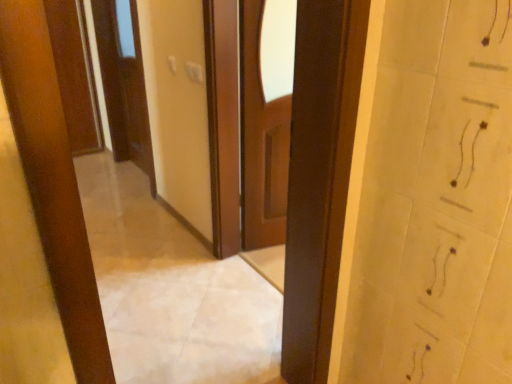
The image size is (512, 384). What do you see at coordinates (124, 85) in the screenshot?
I see `matte brown door at upper left, which ranks as the second door in left-to-right order` at bounding box center [124, 85].

I want to click on matte brown door at upper left, which ranks as the second door in left-to-right order, so click(124, 85).

What is the approximate width of matte brown door at upper left, the 1th door from the right?

6.95 inches.

Measure the distance between point (x=116, y=79) and camera.

The depth of point (x=116, y=79) is 3.57 meters.

What do you see at coordinates (75, 74) in the screenshot?
I see `wooden door at upper left, which ranks as the 1th door in left-to-right order` at bounding box center [75, 74].

The height and width of the screenshot is (384, 512). I want to click on wooden door at upper left, the 2th door positioned from the right, so click(x=75, y=74).

Identify the location of matte brown door at upper left, which ranks as the second door in left-to-right order. The image size is (512, 384). (124, 85).

Is matte brown door at upper left, the 1th door from the right, at the left side of wooden door at upper left, which ranks as the 1th door in left-to-right order?

Incorrect, matte brown door at upper left, the 1th door from the right, is not on the left side of wooden door at upper left, which ranks as the 1th door in left-to-right order.

Which is behind, matte brown door at upper left, the 1th door from the right, or wooden door at upper left, which ranks as the 1th door in left-to-right order?

wooden door at upper left, which ranks as the 1th door in left-to-right order, is behind.

Considering the points (142, 98) and (85, 47), which point is behind, point (142, 98) or point (85, 47)?

The point (85, 47) is more distant.

From the image's perspective, which one is positioned lower, matte brown door at upper left, which ranks as the second door in left-to-right order, or wooden door at upper left, which ranks as the 1th door in left-to-right order?

matte brown door at upper left, which ranks as the second door in left-to-right order.

From a real-world perspective, is matte brown door at upper left, the 1th door from the right, on wooden door at upper left, the 2th door positioned from the right?

Indeed, from a real-world perspective, matte brown door at upper left, the 1th door from the right, stands above wooden door at upper left, the 2th door positioned from the right.

In terms of width, does matte brown door at upper left, the 1th door from the right, look wider or thinner when compared to wooden door at upper left, which ranks as the 1th door in left-to-right order?

In the image, matte brown door at upper left, the 1th door from the right, appears to be wider than wooden door at upper left, which ranks as the 1th door in left-to-right order.

Considering the relative sizes of matte brown door at upper left, which ranks as the second door in left-to-right order, and wooden door at upper left, which ranks as the 1th door in left-to-right order, in the image provided, is matte brown door at upper left, which ranks as the second door in left-to-right order, shorter than wooden door at upper left, which ranks as the 1th door in left-to-right order,?

In fact, matte brown door at upper left, which ranks as the second door in left-to-right order, may be taller than wooden door at upper left, which ranks as the 1th door in left-to-right order.

Based on their sizes in the image, would you say matte brown door at upper left, the 1th door from the right, is bigger or smaller than wooden door at upper left, which ranks as the 1th door in left-to-right order?

matte brown door at upper left, the 1th door from the right, is bigger than wooden door at upper left, which ranks as the 1th door in left-to-right order.

Is wooden door at upper left, the 2th door positioned from the right, located within matte brown door at upper left, the 1th door from the right?

No, wooden door at upper left, the 2th door positioned from the right, is not inside matte brown door at upper left, the 1th door from the right.

Is matte brown door at upper left, the 1th door from the right, far from wooden door at upper left, the 2th door positioned from the right?

matte brown door at upper left, the 1th door from the right, is near wooden door at upper left, the 2th door positioned from the right, not far away.

Is wooden door at upper left, the 2th door positioned from the right, at the back of matte brown door at upper left, which ranks as the second door in left-to-right order?

matte brown door at upper left, which ranks as the second door in left-to-right order, is not turned away from wooden door at upper left, the 2th door positioned from the right.

How far apart are matte brown door at upper left, the 1th door from the right, and wooden door at upper left, the 2th door positioned from the right?

matte brown door at upper left, the 1th door from the right, and wooden door at upper left, the 2th door positioned from the right, are 46.56 centimeters apart from each other.

At what (x,y) coordinates should I click in order to perform the action: click on door that is on the right side of wooden door at upper left, which ranks as the 1th door in left-to-right order. Please return your answer as a coordinate pair (x, y). Looking at the image, I should click on (124, 85).

Does wooden door at upper left, which ranks as the 1th door in left-to-right order, appear on the left side of matte brown door at upper left, the 1th door from the right?

Yes, wooden door at upper left, which ranks as the 1th door in left-to-right order, is to the left of matte brown door at upper left, the 1th door from the right.

Which is in front, wooden door at upper left, which ranks as the 1th door in left-to-right order, or matte brown door at upper left, which ranks as the second door in left-to-right order?

matte brown door at upper left, which ranks as the second door in left-to-right order.

Does point (73, 52) lie in front of point (117, 95)?

No.

From the image's perspective, between wooden door at upper left, the 2th door positioned from the right, and matte brown door at upper left, the 1th door from the right, who is located below?

From the image's view, matte brown door at upper left, the 1th door from the right, is below.

From a real-world perspective, between wooden door at upper left, the 2th door positioned from the right, and matte brown door at upper left, the 1th door from the right, who is vertically lower?

wooden door at upper left, the 2th door positioned from the right, from a real-world perspective.

Can you confirm if wooden door at upper left, the 2th door positioned from the right, is wider than matte brown door at upper left, the 1th door from the right?

Incorrect, the width of wooden door at upper left, the 2th door positioned from the right, does not surpass that of matte brown door at upper left, the 1th door from the right.

Can you confirm if wooden door at upper left, which ranks as the 1th door in left-to-right order, is taller than matte brown door at upper left, which ranks as the second door in left-to-right order?

No.

Between wooden door at upper left, which ranks as the 1th door in left-to-right order, and matte brown door at upper left, which ranks as the second door in left-to-right order, which one has larger size?

matte brown door at upper left, which ranks as the second door in left-to-right order.

Choose the correct answer: Is wooden door at upper left, the 2th door positioned from the right, inside matte brown door at upper left, which ranks as the second door in left-to-right order, or outside it?

wooden door at upper left, the 2th door positioned from the right, exists outside the volume of matte brown door at upper left, which ranks as the second door in left-to-right order.

Based on the photo, is wooden door at upper left, which ranks as the 1th door in left-to-right order, next to matte brown door at upper left, the 1th door from the right, and touching it?

wooden door at upper left, which ranks as the 1th door in left-to-right order, is not next to matte brown door at upper left, the 1th door from the right, and they're not touching.

In the scene shown: Is wooden door at upper left, the 2th door positioned from the right, aimed at matte brown door at upper left, the 1th door from the right?

Yes, wooden door at upper left, the 2th door positioned from the right, faces towards matte brown door at upper left, the 1th door from the right.

How different are the orientations of wooden door at upper left, which ranks as the 1th door in left-to-right order, and matte brown door at upper left, which ranks as the second door in left-to-right order, in degrees?

They differ by 90.2 degrees in their facing directions.

This screenshot has height=384, width=512. In order to click on door below the matte brown door at upper left, the 1th door from the right (from a real-world perspective) in this screenshot , I will do `click(75, 74)`.

Locate an element on the screen. The width and height of the screenshot is (512, 384). door behind the matte brown door at upper left, the 1th door from the right is located at coordinates (75, 74).

At what (x,y) coordinates should I click in order to perform the action: click on door above the matte brown door at upper left, which ranks as the second door in left-to-right order (from the image's perspective). Please return your answer as a coordinate pair (x, y). This screenshot has height=384, width=512. Looking at the image, I should click on (75, 74).